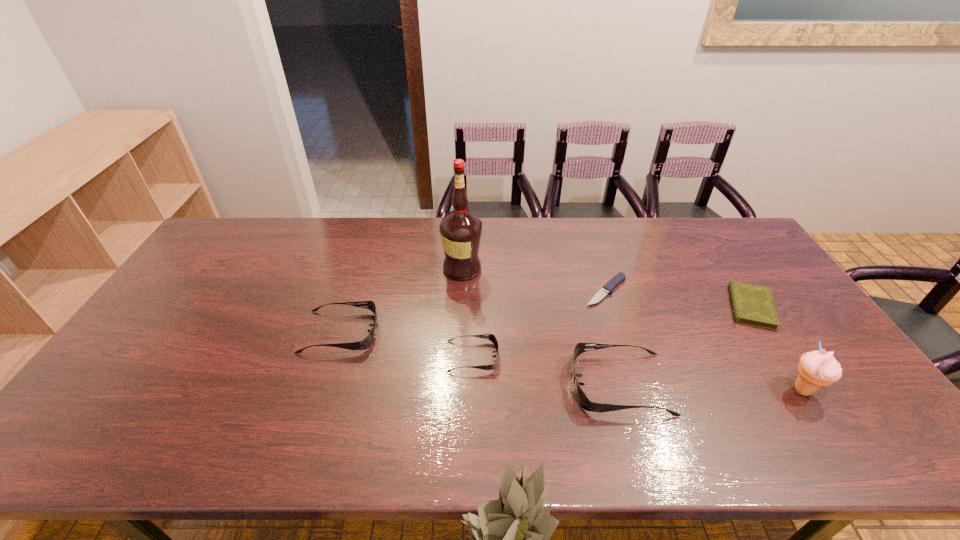
The image size is (960, 540). I want to click on the leftmost object, so click(367, 341).

This screenshot has width=960, height=540. Find the location of `the leftmost sunglasses`. the leftmost sunglasses is located at coordinates (367, 341).

I want to click on the second sunglasses from left to right, so click(491, 337).

Image resolution: width=960 pixels, height=540 pixels. I want to click on the shortest sunglasses, so (491, 337).

Where is `the rightmost sunglasses`? the rightmost sunglasses is located at coordinates (586, 404).

You are a GUI agent. You are given a task and a screenshot of the screen. Output one action in this format:
    pyautogui.click(x=<x>, y=<y>)
    Task: Click on the alcohol
    
    Given the screenshot: What is the action you would take?
    pyautogui.click(x=460, y=230)

In order to click on diary in this screenshot , I will do `click(754, 305)`.

Image resolution: width=960 pixels, height=540 pixels. What are the coordinates of `icecream` in the screenshot? It's located at tap(819, 368).

You are a GUI agent. You are given a task and a screenshot of the screen. Output one action in this format:
    pyautogui.click(x=<x>, y=<y>)
    Task: Click on the steak knife
    
    Given the screenshot: What is the action you would take?
    pyautogui.click(x=620, y=277)

This screenshot has width=960, height=540. I want to click on free space located on the front-facing side of the leftmost sunglasses, so tap(483, 332).